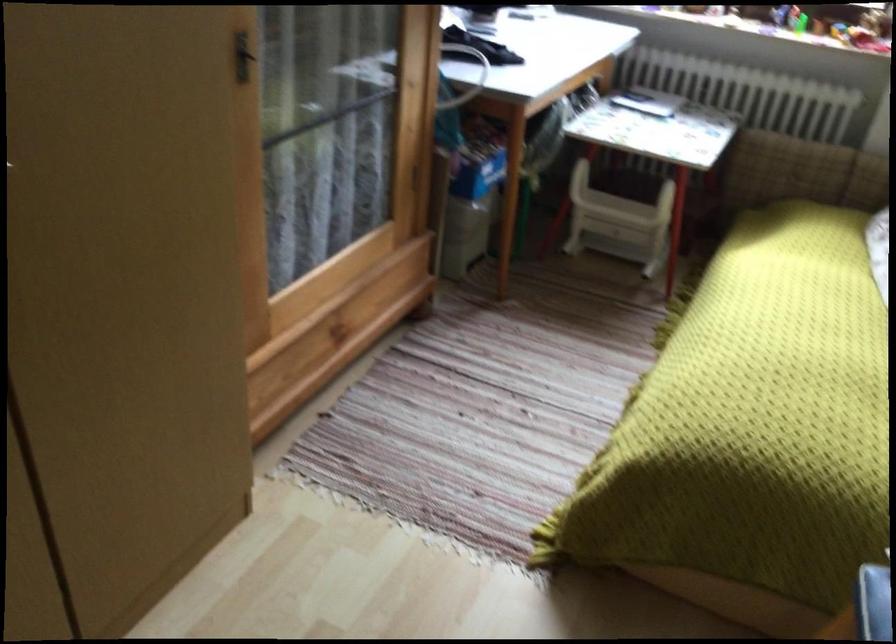
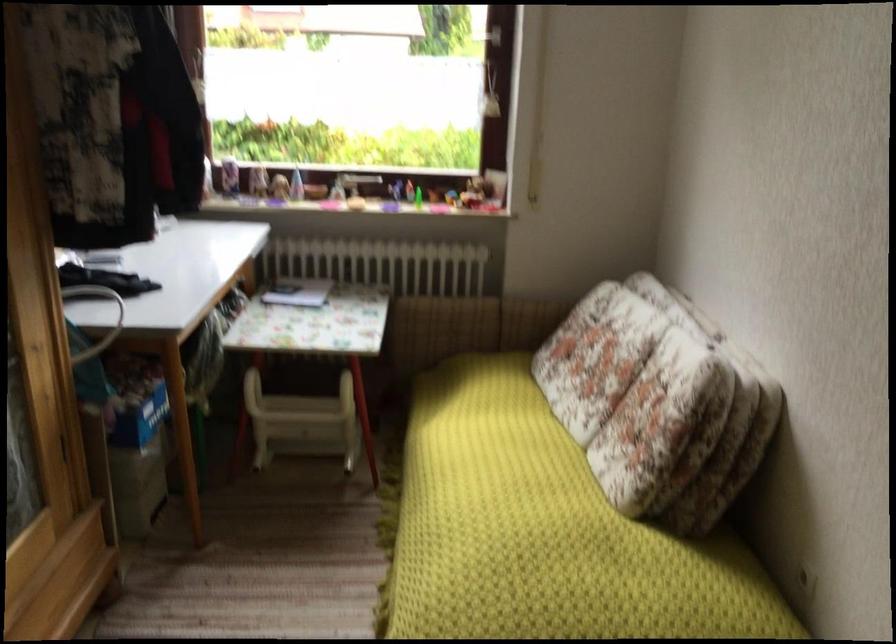
Find the pixel in the second image that matches (810,359) in the first image.

(544, 532)